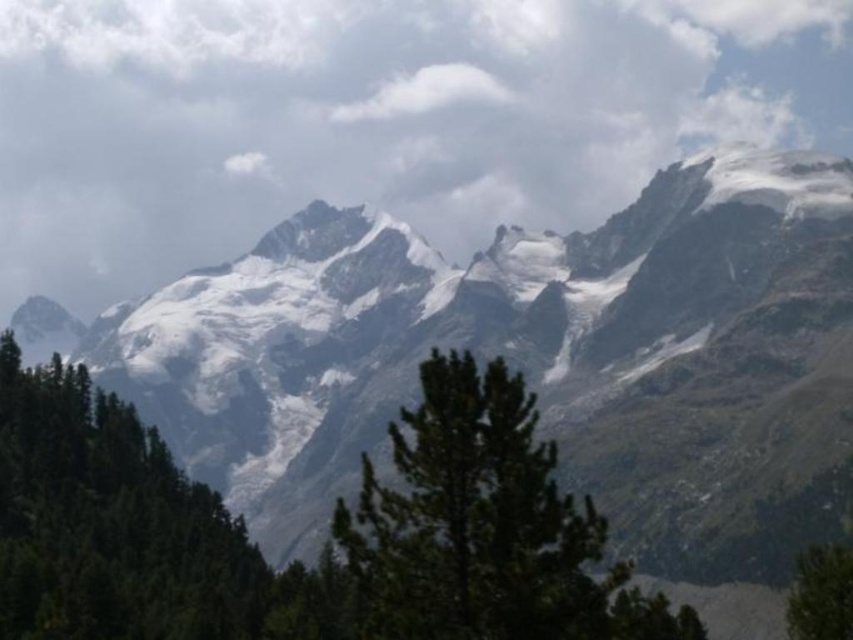
Looking at this image, you are standing in the mountain area and want to take a photo of both the green matte tree at left and the green matte tree at lower right. Which tree should you move closer to first to ensure both are in focus?

You should move closer to the green matte tree at lower right first because it is farther away from you than the green matte tree at left, so adjusting your position to focus on the farther tree first will help both be in focus.